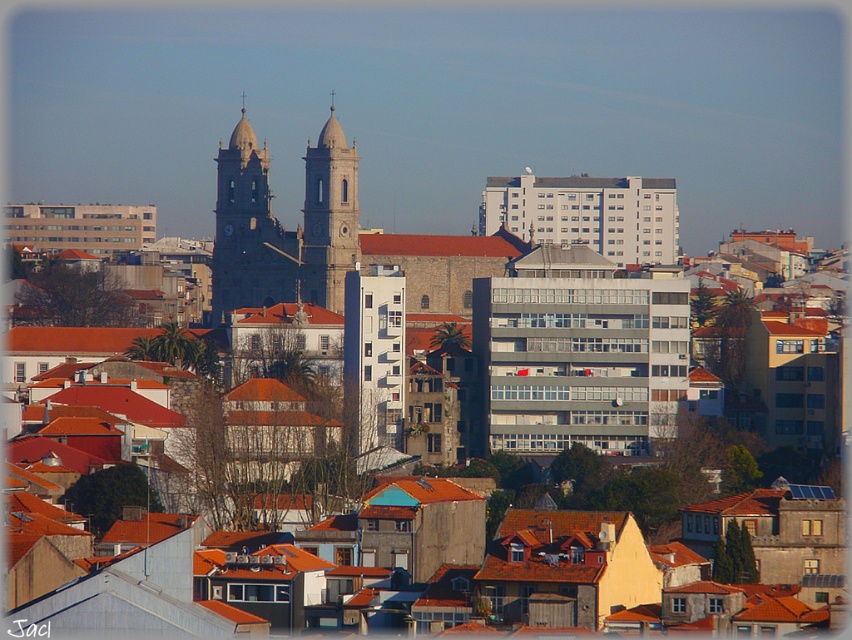
You are a tourist standing in the city square looking at the two towers. Which tower, the dark gray stone tower at center or the light beige stone tower at center, is taller?

The dark gray stone tower at center is much taller than the light beige stone tower at center.

Based on the photo, you are an architect analyzing the city layout. From your current viewpoint, which of the two towers, the dark gray stone tower at center or the light beige stone tower at center, appears closer to you?

The dark gray stone tower at center appears closer because the light beige stone tower at center is positioned behind it.

You are a city planner assessing the skyline. The dark gray stone tower at center and the light beige stone tower at center are both part of the church. Which tower has a larger footprint?

The dark gray stone tower at center might be wider than light beige stone tower at center, so it likely has a larger footprint.